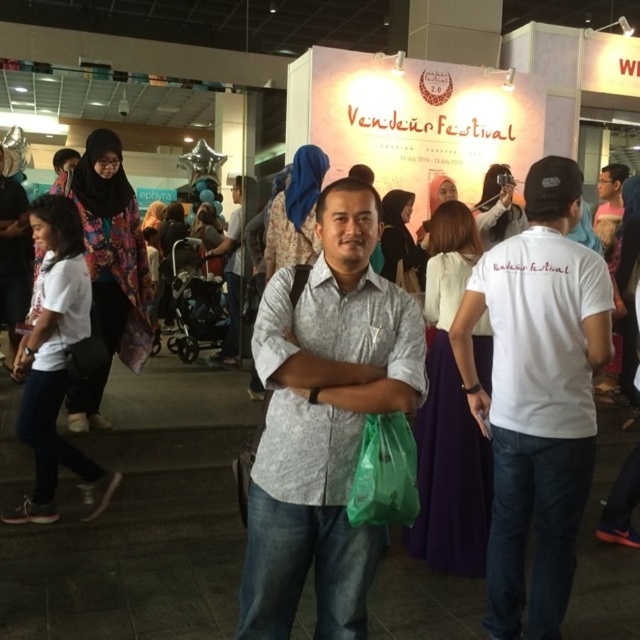
Question: Which of the following is the closest to the observer?

Choices:
 (A) (440, 177)
 (B) (76, 170)
 (C) (8, 282)
 (D) (269, 227)

Answer: (B)

Question: Estimate the real-world distances between objects in this image. Which object is closer to the matte white dress at center?

Choices:
 (A) white matte shirt at left
 (B) matte black camera at upper center
 (C) matte white shirt at center

Answer: (B)

Question: From the image, what is the correct spatial relationship of white cotton t-shirt at center in relation to purple satin dress at center?

Choices:
 (A) below
 (B) above

Answer: (A)

Question: Does white printed shirt at center come in front of matte white shirt at center?

Choices:
 (A) no
 (B) yes

Answer: (B)

Question: Which object is the closest to the purple satin dress at center?

Choices:
 (A) matte white shirt at upper right
 (B) matte black camera at upper center
 (C) matte white shirt at center
 (D) blue satin hijab at center

Answer: (D)

Question: Is purple satin dress at center closer to the viewer compared to matte black camera at upper center?

Choices:
 (A) yes
 (B) no

Answer: (A)